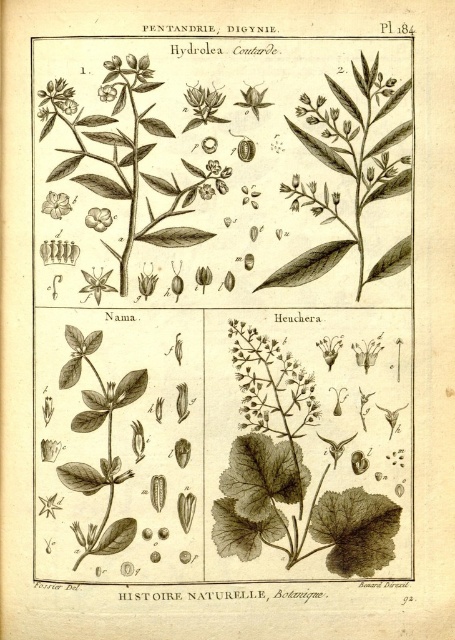
Looking at the top section of the botanical illustration, you see the brown textured flower at upper left and the matte yellow flower at upper left. Which flower has a larger size?

The brown textured flower at upper left is bigger than the matte yellow flower at upper left.

Looking at the top section of the botanical illustration, you see a brown textured flower at upper left and a smooth white flower at upper left. Which flower is located more to the left?

The brown textured flower at upper left is more to the left than the smooth white flower at upper left.